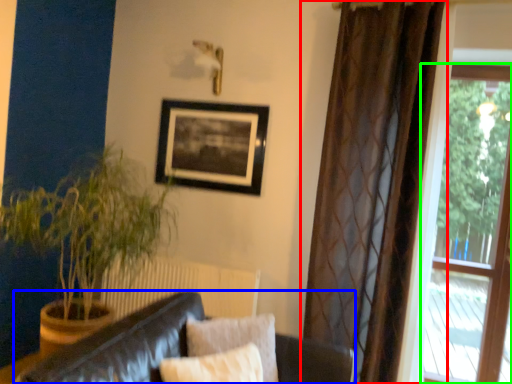
Question: Which is farther away from curtain (highlighted by a red box)? studio couch (highlighted by a blue box) or window (highlighted by a green box)?

Choices:
 (A) studio couch
 (B) window

Answer: (B)